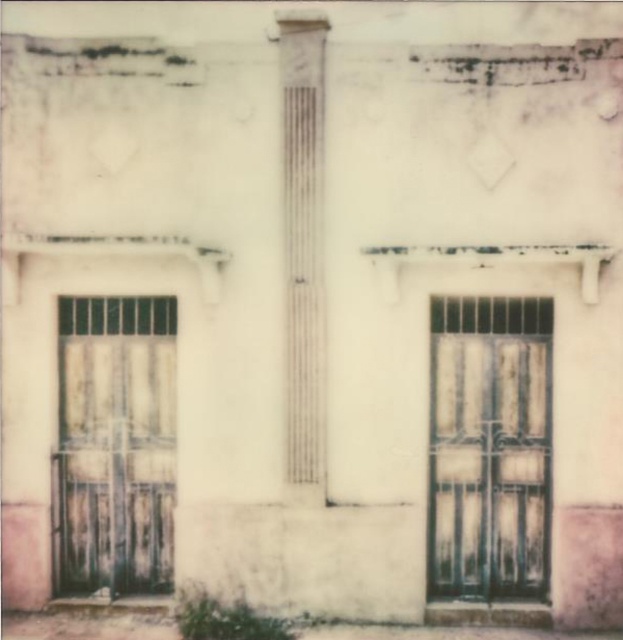
You are an architect assessing the building facade. You notice the dark green wrought iron door at right and the white textured column at center. Which object occupies more space in the image?

The dark green wrought iron door at right is bigger than the white textured column at center, so it occupies more space in the image.

You are an architect assessing the building facade. You need to determine if the dark green wrought iron door at right can be seen in full from the ground level without obstruction. Considering the height difference between it and the rusty metal gate at left, what is your conclusion?

The dark green wrought iron door at right has a lesser height compared to the rusty metal gate at left, so it can be seen in full from the ground level without obstruction since it is shorter than the gate.

Based on the photo, you are a delivery person trying to enter the building. You see the dark green wrought iron door at right and the rusty metal gate at left. Which one is located to the right side of the other?

The dark green wrought iron door at right is located to the right of the rusty metal gate at left.